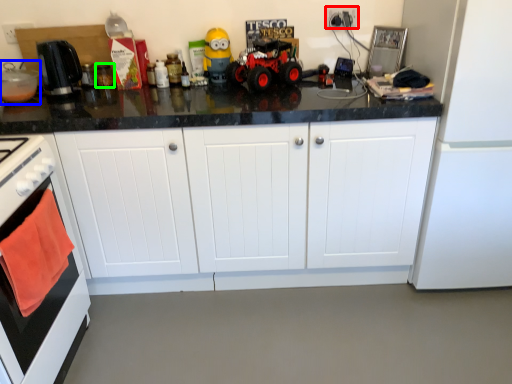
Question: Estimate the real-world distances between objects in this image. Which object is closer to electric outlet (highlighted by a red box), appliance (highlighted by a blue box) or appliance (highlighted by a green box)?

Choices:
 (A) appliance
 (B) appliance

Answer: (B)